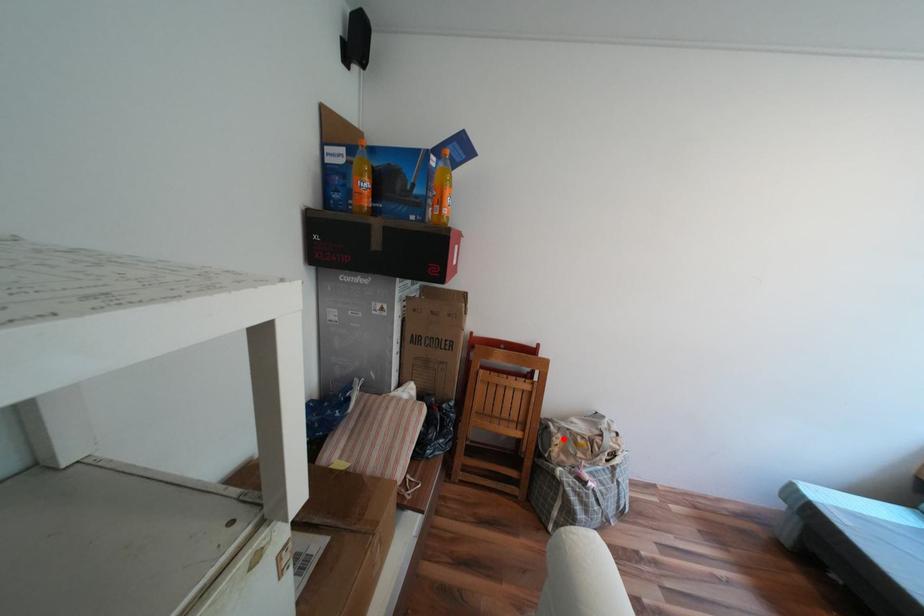
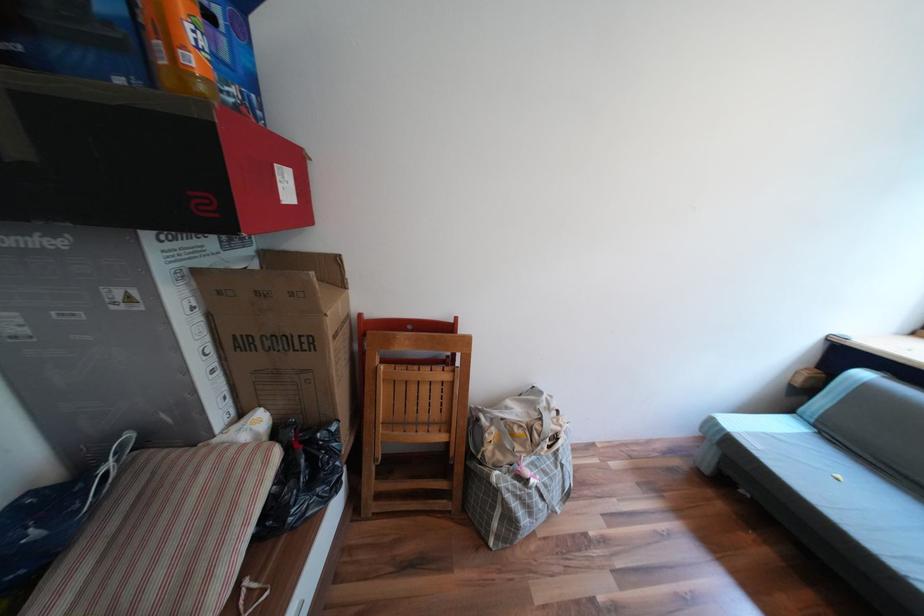
In the second image, find the point that corresponds to the highlighted location in the first image.

(495, 435)